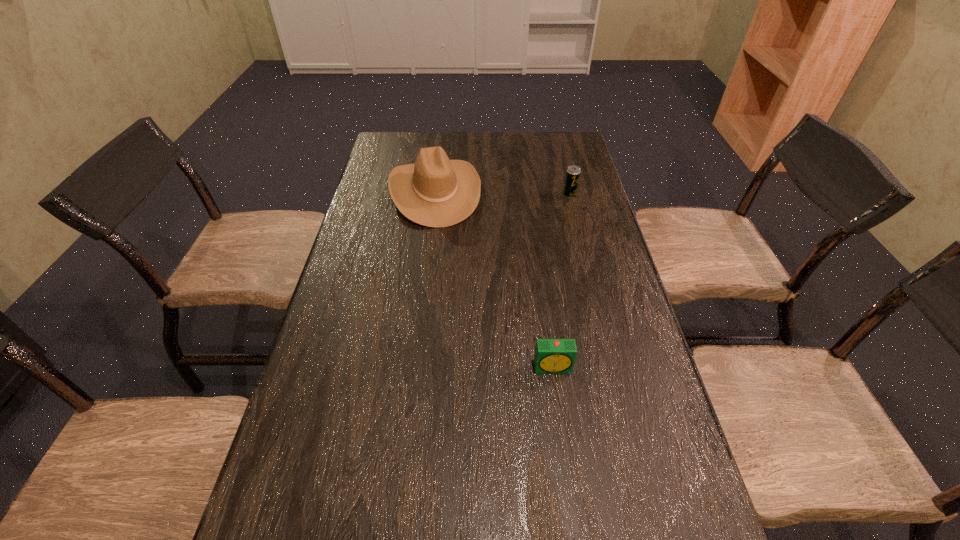
Locate an element on the screen. This screenshot has height=540, width=960. vacant point located between the shortest object and the beer can is located at coordinates (562, 281).

At what (x,y) coordinates should I click in order to perform the action: click on vacant area that lies between the leftmost object and the rightmost object. Please return your answer as a coordinate pair (x, y). Looking at the image, I should click on (502, 193).

Identify which object is the closest to the beer can. Please provide its 2D coordinates. Your answer should be formatted as a tuple, i.e. [(x, y)], where the tuple contains the x and y coordinates of a point satisfying the conditions above.

[(434, 191)]

Choose which object is the nearest neighbor to the alarm clock. Please provide its 2D coordinates. Your answer should be formatted as a tuple, i.e. [(x, y)], where the tuple contains the x and y coordinates of a point satisfying the conditions above.

[(434, 191)]